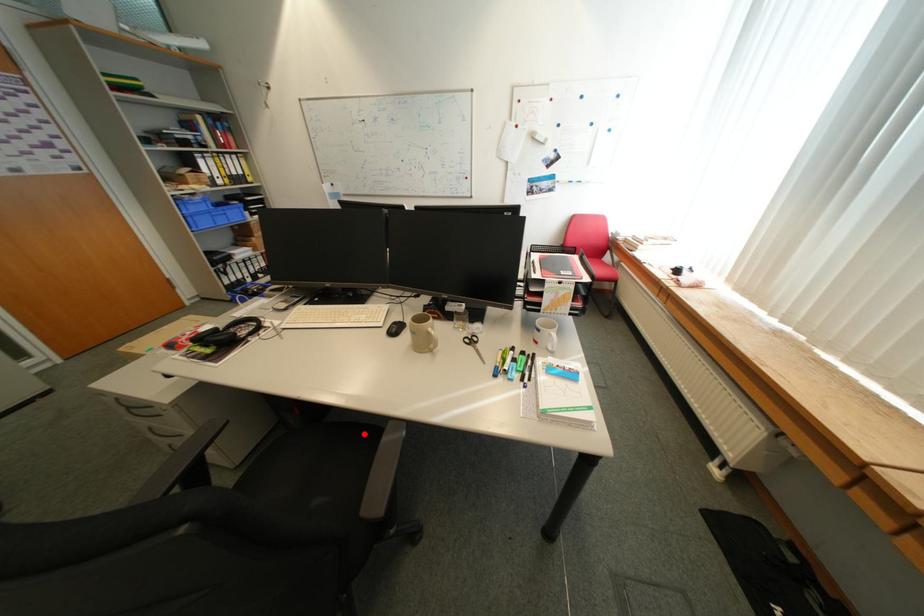
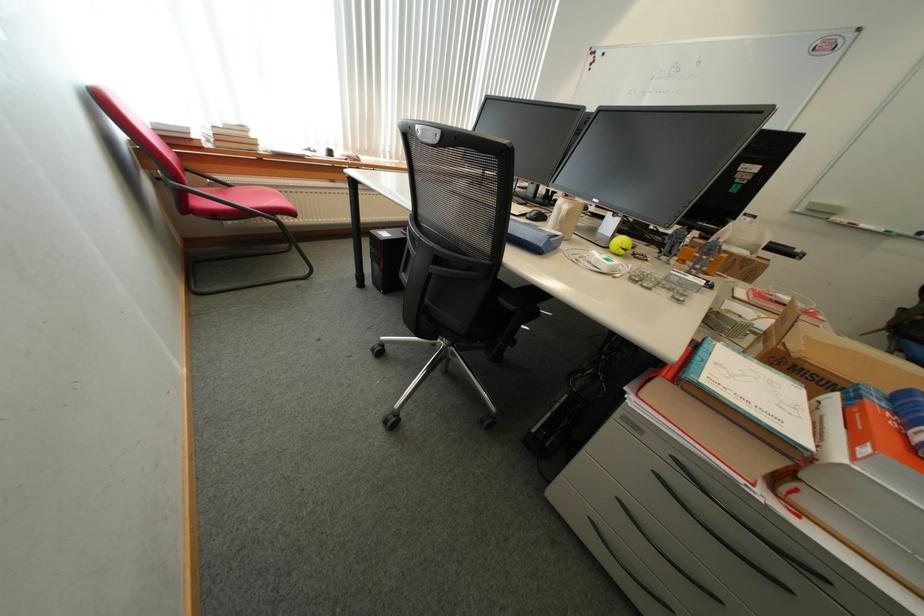
Question: I am providing you with two images of the same scene from different viewpoints. A red point is marked on the first image. At the location where the point appears in image 1, is it still visible in image 2?

Choices:
 (A) Yes
 (B) No

Answer: (B)